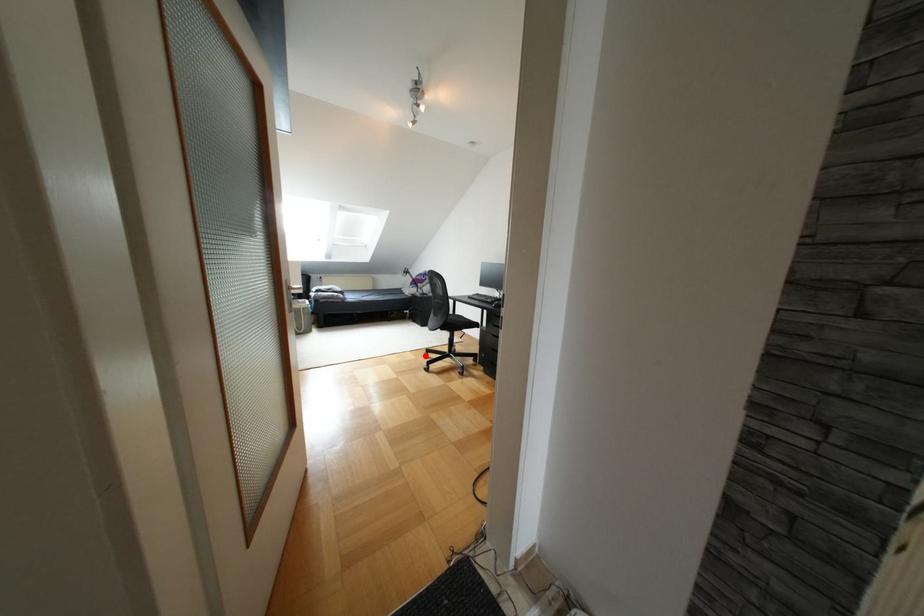
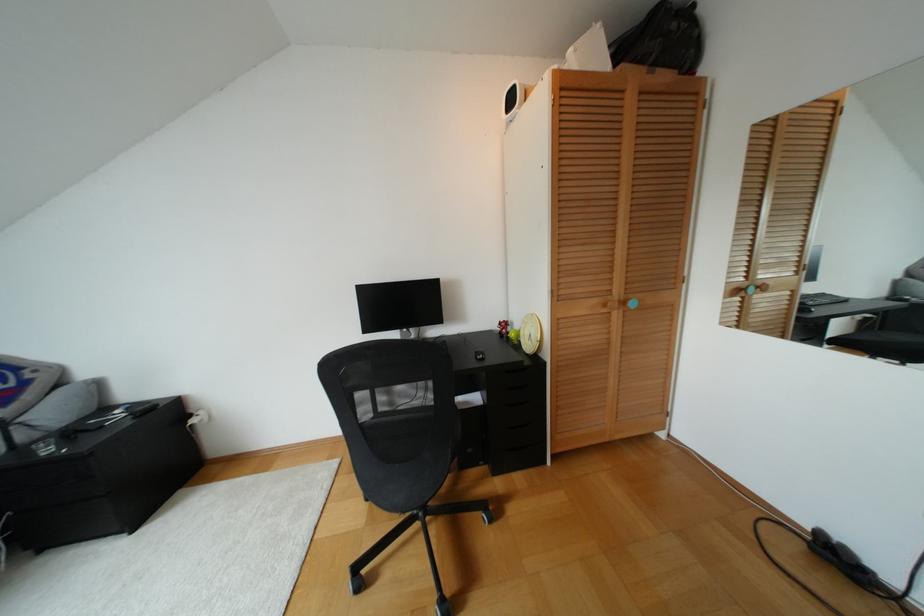
Question: I am providing you with two images of the same scene from different viewpoints. A red point is shown in image1. For the corresponding object point in image2, is it positioned nearer or farther from the camera?

Choices:
 (A) Nearer
 (B) Farther

Answer: (A)